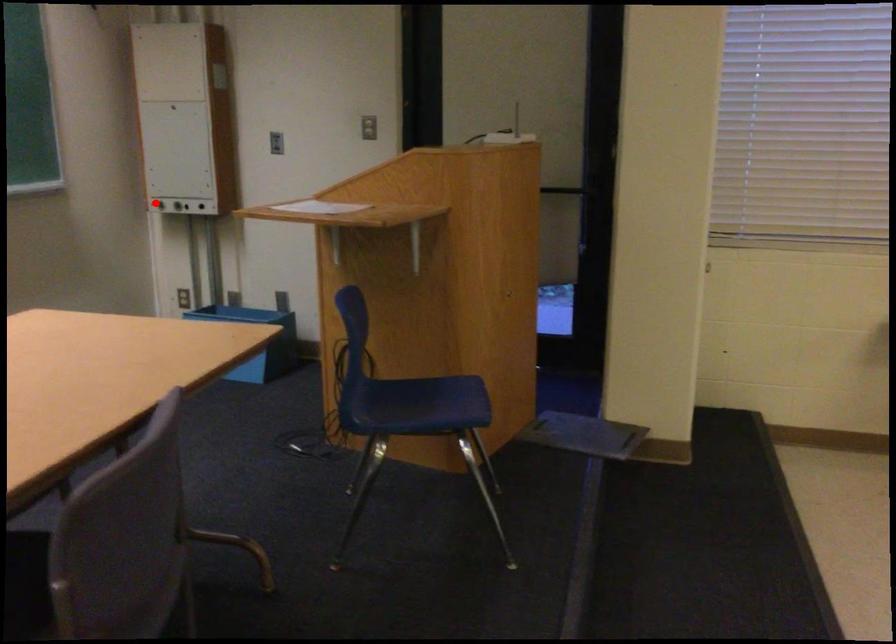
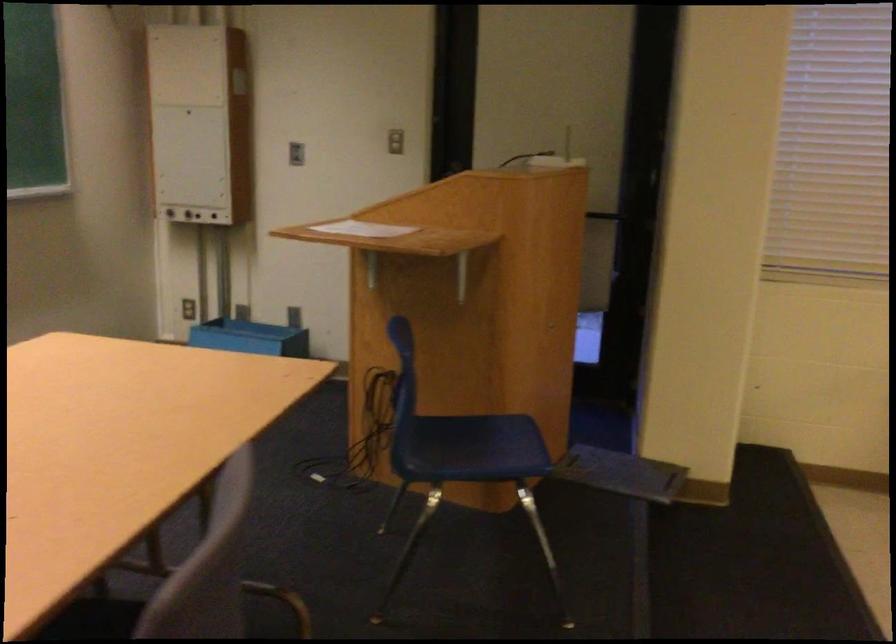
Find the pixel in the second image that matches the highlighted location in the first image.

(167, 210)